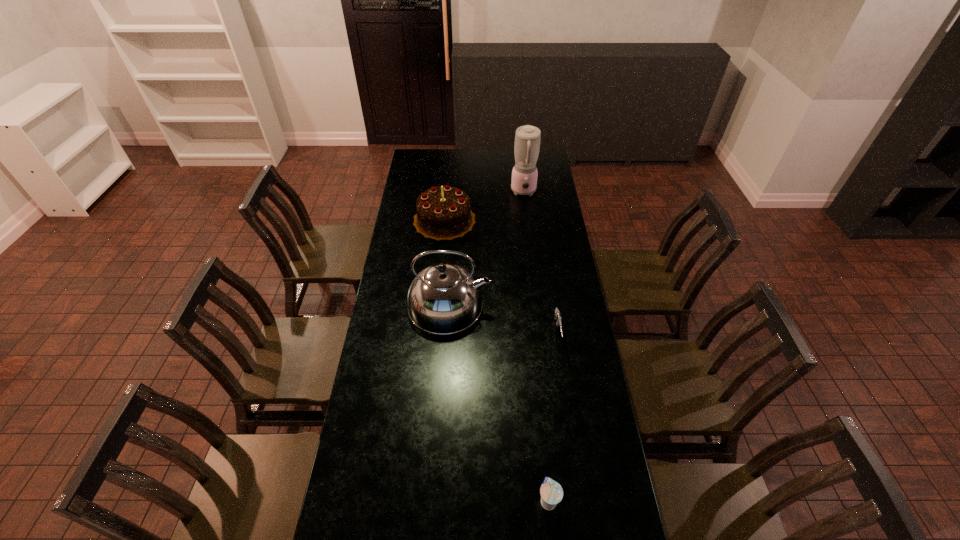
I want to click on the tallest object, so (x=527, y=138).

This screenshot has height=540, width=960. Find the location of `kettle`. kettle is located at coordinates (444, 298).

The image size is (960, 540). In order to click on the third shortest object in this screenshot , I will do `click(443, 213)`.

I want to click on gun, so click(557, 314).

This screenshot has height=540, width=960. I want to click on the nearest object, so click(x=551, y=492).

This screenshot has height=540, width=960. I want to click on vacant space situated on the base of the food processor near the control knob, so click(526, 208).

Locate an element on the screen. The image size is (960, 540). vacant space located 0.180m from the spout of the second tallest object is located at coordinates (533, 305).

Find the location of `vacant region located on the front of the third shortest object`. vacant region located on the front of the third shortest object is located at coordinates (440, 268).

The width and height of the screenshot is (960, 540). Identify the location of free region located at the barrel of the gun. (566, 392).

Image resolution: width=960 pixels, height=540 pixels. Identify the location of vacant area located 0.400m on the back of the nearest object. (536, 373).